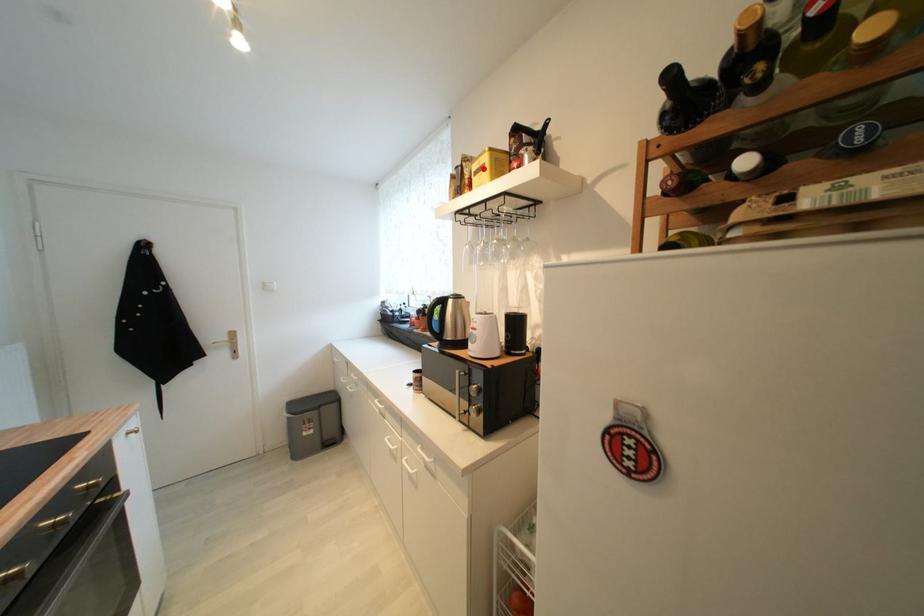
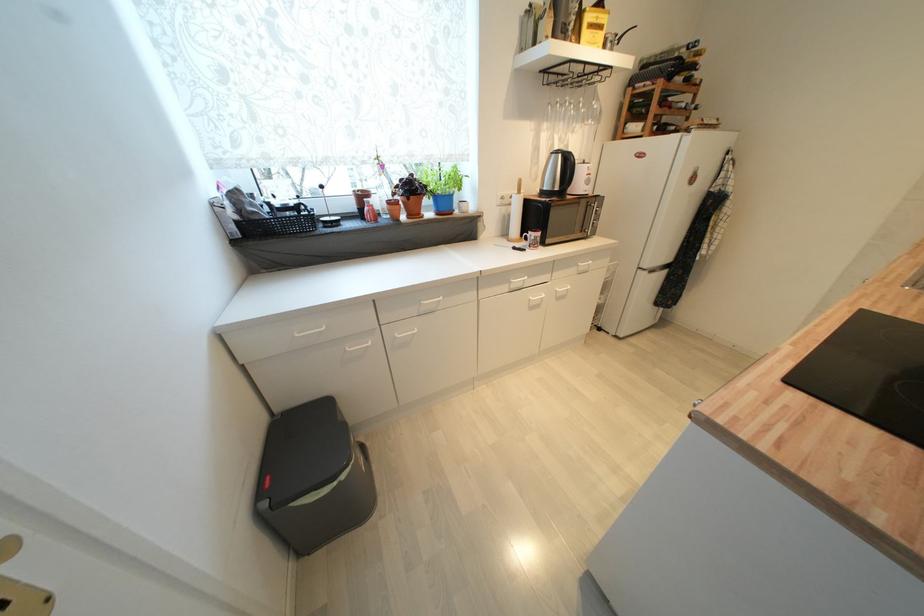
Where in the second image is the point corresponding to the highlighted location from the first image?

(600, 23)